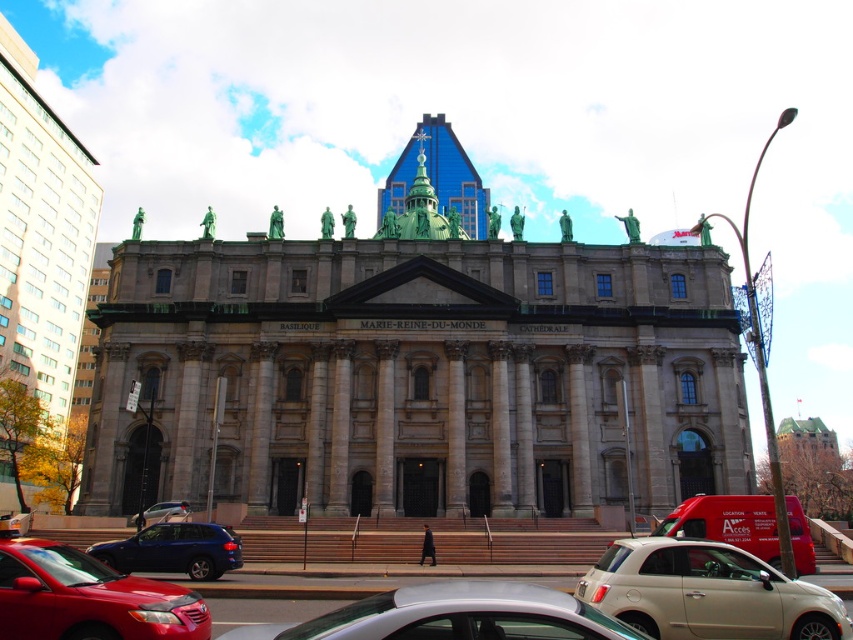
Question: Does beige matte car at lower center appear on the left side of shiny blue suv at lower left?

Choices:
 (A) no
 (B) yes

Answer: (A)

Question: Which point is closer to the camera?

Choices:
 (A) (157, 529)
 (B) (173, 609)
 (C) (689, 547)

Answer: (B)

Question: Is shiny blue suv at lower left further to camera compared to matte silver car at center?

Choices:
 (A) no
 (B) yes

Answer: (A)

Question: Observing the image, what is the correct spatial positioning of beige matte car at lower center in reference to matte silver car at center?

Choices:
 (A) right
 (B) left

Answer: (A)

Question: Which point is farther to the camera?

Choices:
 (A) (170, 554)
 (B) (71, 554)

Answer: (A)

Question: Which object is the closest to the shiny blue suv at lower left?

Choices:
 (A) shiny red sedan at lower left
 (B) beige matte car at lower center
 (C) silver metallic sedan at lower center

Answer: (A)